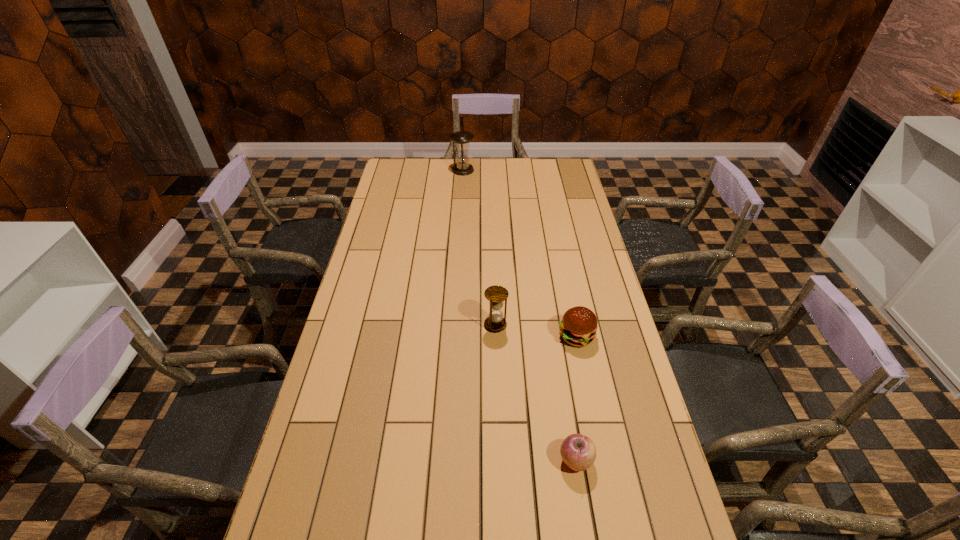
The width and height of the screenshot is (960, 540). I want to click on object that is at the far edge, so click(461, 139).

I want to click on object positioned at the right edge, so click(x=578, y=327).

Identify the location of blank space at the far edge. (431, 168).

You are a GUI agent. You are given a task and a screenshot of the screen. Output one action in this format:
    pyautogui.click(x=<x>, y=<y>)
    Task: Click on the vacant space at the left edge of the desktop
    
    Given the screenshot: What is the action you would take?
    pyautogui.click(x=348, y=311)

This screenshot has height=540, width=960. Find the location of `free space at the right edge of the desktop`. free space at the right edge of the desktop is located at coordinates (569, 218).

This screenshot has height=540, width=960. Identify the location of vacant area at the far left corner. (417, 159).

Image resolution: width=960 pixels, height=540 pixels. What are the coordinates of `vacant space that is in between the right hourglass and the hamburger` in the screenshot? It's located at (536, 330).

Image resolution: width=960 pixels, height=540 pixels. Identify the location of vacant space in between the apple and the leftmost object. (519, 315).

You are a GUI agent. You are given a task and a screenshot of the screen. Output one action in this format:
    pyautogui.click(x=<x>, y=<y>)
    Task: Click on the vacant area that lies between the nearest object and the hamburger
    The image size is (960, 540).
    Given the screenshot: What is the action you would take?
    pyautogui.click(x=576, y=399)

Where is `blank region between the hamburger and the apple`? Image resolution: width=960 pixels, height=540 pixels. blank region between the hamburger and the apple is located at coordinates (576, 399).